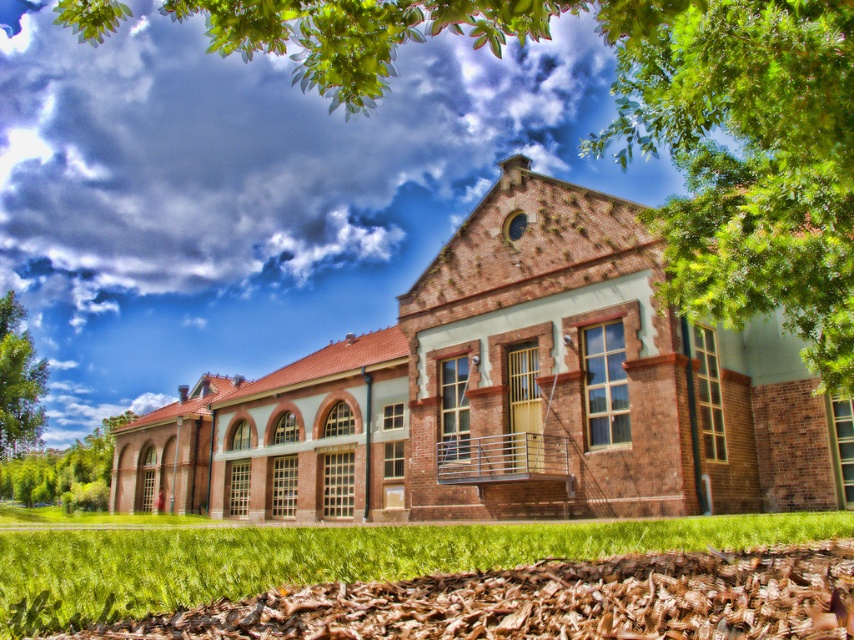
Question: Is the position of green leafy tree at upper center less distant than that of green leafy tree at left?

Choices:
 (A) no
 (B) yes

Answer: (B)

Question: Does green leafy tree at upper center have a smaller size compared to green leafy tree at left?

Choices:
 (A) no
 (B) yes

Answer: (A)

Question: Observing the image, what is the correct spatial positioning of green leafy tree at upper center in reference to green leafy tree at lower left?

Choices:
 (A) above
 (B) below

Answer: (A)

Question: Which object appears closest to the camera in this image?

Choices:
 (A) green leafy tree at upper center
 (B) green leafy tree at left
 (C) green leafy tree at lower left

Answer: (A)

Question: Estimate the real-world distances between objects in this image. Which object is farther from the green leafy tree at upper center?

Choices:
 (A) green leafy tree at left
 (B) green leafy tree at lower left

Answer: (B)

Question: Among these objects, which one is nearest to the camera?

Choices:
 (A) green leafy tree at lower left
 (B) green leafy tree at upper center

Answer: (B)